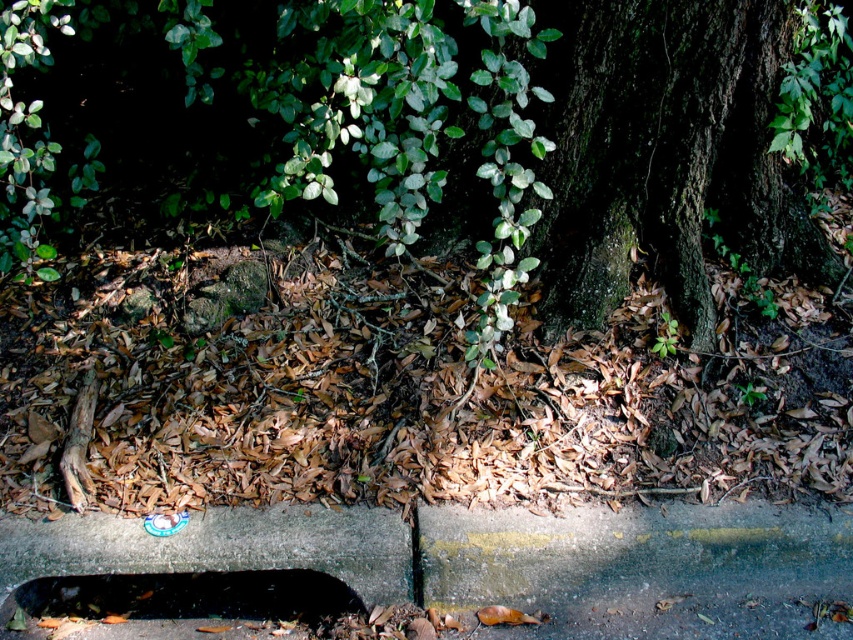
You are a gardener trying to plant a new flower in the dark gray concrete hole at lower center. However, you notice the green rough bark tree trunk at center is in the way. Can you still access the hole easily?

The green rough bark tree trunk at center is positioned over the dark gray concrete hole at lower center, so it might block access to the hole. You may need to move the tree trunk or work around it to plant the flower.

You are a gardener who wants to plant a new bush between the green rough bark tree trunk at center and the dark gray concrete hole at lower center. Based on their positions, which object should you start near to ensure the bush is placed between them?

Since the green rough bark tree trunk at center is positioned on the right side of the dark gray concrete hole at lower center, you should start near the dark gray concrete hole at lower center to plant the bush between them.